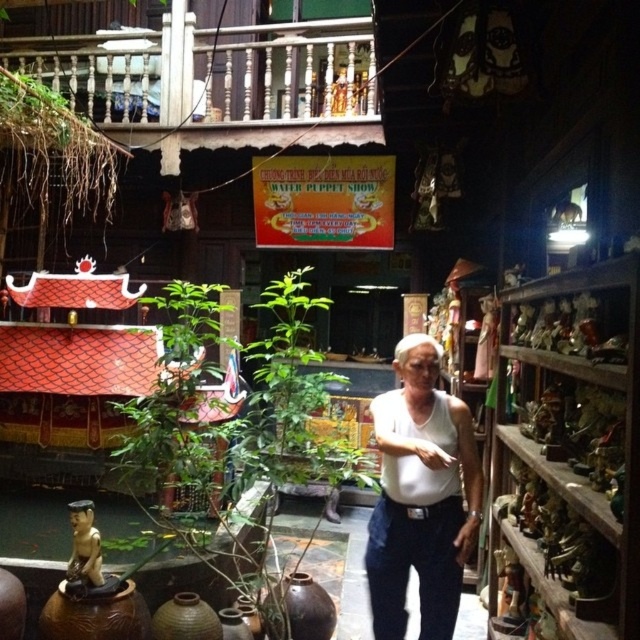
Between point (284, 324) and point (406, 349), which one is positioned behind?

Positioned behind is point (284, 324).

Is green leafy plant at center to the left of white cotton tank top at center from the viewer's perspective?

Yes, green leafy plant at center is to the left of white cotton tank top at center.

Locate an element on the screen. green leafy plant at center is located at coordinates (246, 400).

Find the location of a particular element. Image resolution: width=640 pixels, height=640 pixels. green leafy plant at center is located at coordinates (246, 400).